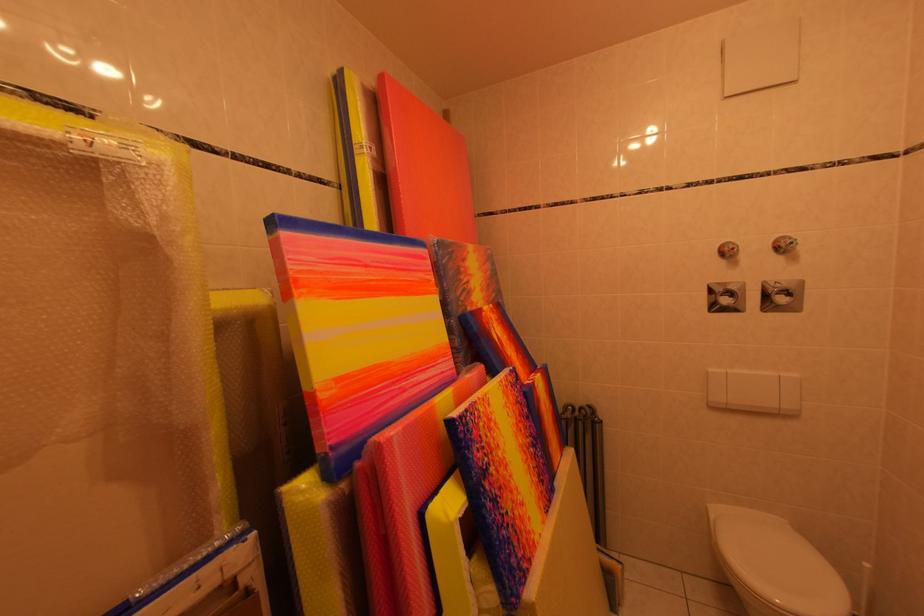
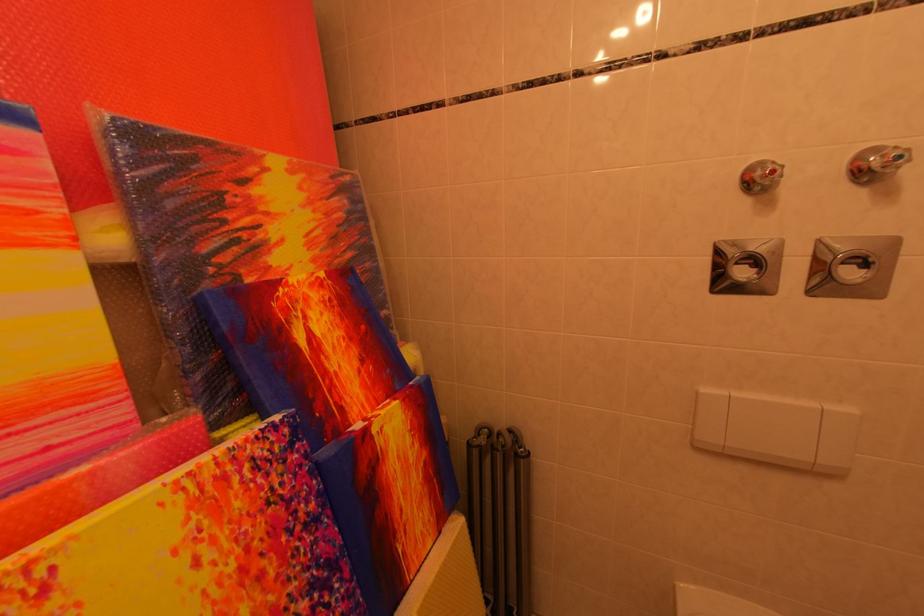
Question: Based on the continuous images, in which direction is the camera rotating? Reply with the corresponding letter.

Choices:
 (A) Left
 (B) Right
 (C) Up
 (D) Down

Answer: (D)